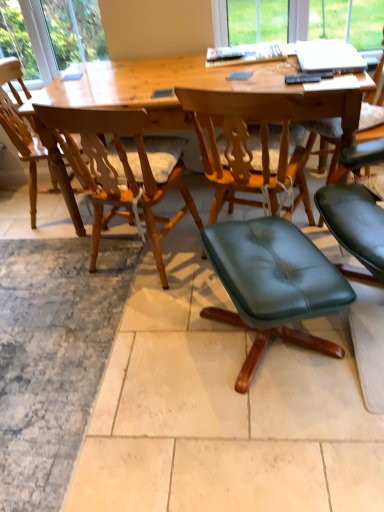
The width and height of the screenshot is (384, 512). Find the location of `vacant space situated on the left part of green leather ottoman at lower right, marked as the 2th chair in a right-to-left arrangement`. vacant space situated on the left part of green leather ottoman at lower right, marked as the 2th chair in a right-to-left arrangement is located at coordinates (150, 359).